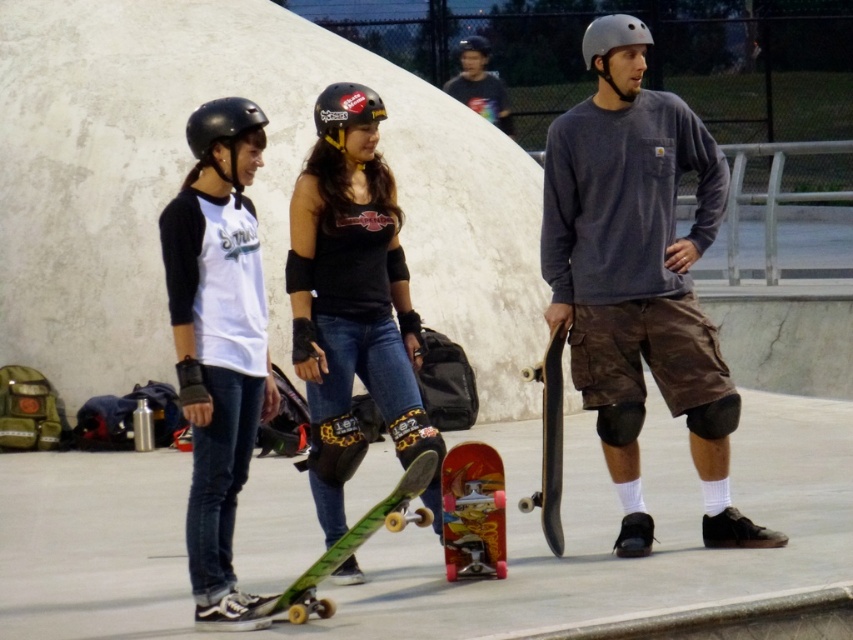
Based on the coordinates provided, which object corresponds to the point at (x=640, y=288) in the skate park scene?

The point at (x=640, y=288) corresponds to the matte gray helmet at center.

You are at the skate park and want to move from the point at coordinates point (x=236, y=374) to the point at coordinates point (x=544, y=372). Which direction should you move in to get closer to your destination?

To move from point (x=236, y=374) to point (x=544, y=372), you should move upward because point (x=236, y=374) is in front of point (x=544, y=372). Since the first point is in front, moving toward the back would bring you closer to the second point.

You are a photographer at the skate park and want to capture both the matte black helmet at left and the matte black helmet at upper center in your shot. Which helmet appears taller in the photo?

The matte black helmet at upper center appears taller in the photo because it is taller than the matte black helmet at left.